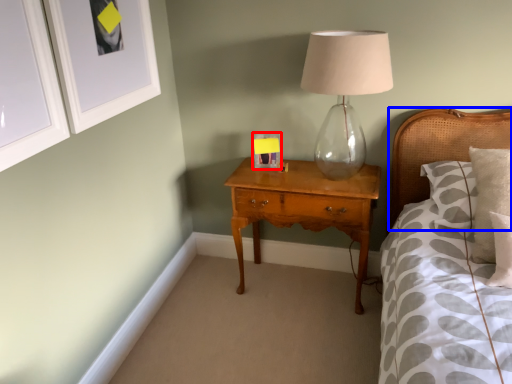
Question: Which object appears closest to the camera in this image, picture frame (highlighted by a red box) or headboard (highlighted by a blue box)?

Choices:
 (A) picture frame
 (B) headboard

Answer: (B)